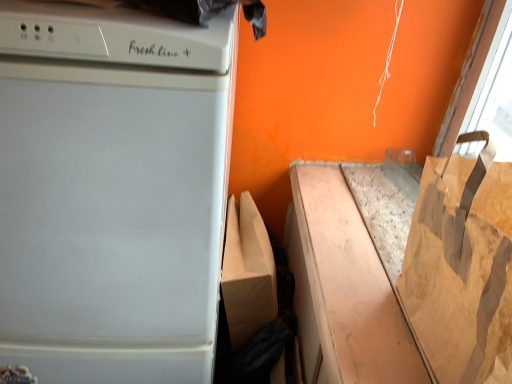
Question: Does brown paper bag at lower right appear on the left side of white glossy dishwasher at left?

Choices:
 (A) no
 (B) yes

Answer: (A)

Question: Is brown paper bag at lower right outside white glossy dishwasher at left?

Choices:
 (A) yes
 (B) no

Answer: (A)

Question: From a real-world perspective, is brown paper bag at lower right on top of white glossy dishwasher at left?

Choices:
 (A) no
 (B) yes

Answer: (B)

Question: Does brown paper bag at lower right have a larger size compared to white glossy dishwasher at left?

Choices:
 (A) no
 (B) yes

Answer: (A)

Question: Can you confirm if brown paper bag at lower right is positioned to the right of white glossy dishwasher at left?

Choices:
 (A) no
 (B) yes

Answer: (B)

Question: From the image's perspective, is white glossy dishwasher at left positioned above or below brown paper bag at lower right?

Choices:
 (A) below
 (B) above

Answer: (A)

Question: Looking at the image, does white glossy dishwasher at left seem bigger or smaller compared to brown paper bag at lower right?

Choices:
 (A) small
 (B) big

Answer: (B)

Question: Is white glossy dishwasher at left inside or outside of brown paper bag at lower right?

Choices:
 (A) outside
 (B) inside

Answer: (A)

Question: In the image, is white glossy dishwasher at left on the left side or the right side of brown paper bag at lower right?

Choices:
 (A) right
 (B) left

Answer: (B)

Question: Is brown paper bag at right taller or shorter than brown paper bag at lower right?

Choices:
 (A) tall
 (B) short

Answer: (A)

Question: Relative to brown paper bag at lower right, is brown paper bag at right in front or behind?

Choices:
 (A) front
 (B) behind

Answer: (A)

Question: In terms of width, does brown paper bag at right look wider or thinner when compared to brown paper bag at lower right?

Choices:
 (A) wide
 (B) thin

Answer: (B)

Question: Considering the positions of point (484, 364) and point (313, 263), is point (484, 364) closer or farther from the camera than point (313, 263)?

Choices:
 (A) closer
 (B) farther

Answer: (A)

Question: In terms of width, does brown paper bag at lower right look wider or thinner when compared to brown paper bag at right?

Choices:
 (A) thin
 (B) wide

Answer: (B)

Question: Considering the positions of brown paper bag at lower right and brown paper bag at right in the image, is brown paper bag at lower right bigger or smaller than brown paper bag at right?

Choices:
 (A) small
 (B) big

Answer: (A)